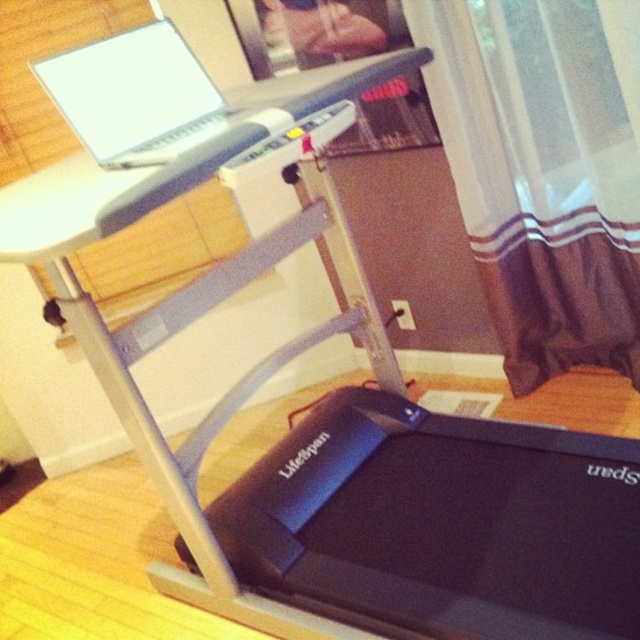
You are standing at the center of the room facing the treadmill. Which direction should you turn to look at the brown sheer curtain at right?

The brown sheer curtain at right is located at the right side of the room, so you should turn to your right to face it.

You are setting up a home office and need to place a new monitor on the desk. The monitor will be placed to the right of the white matte laptop at upper left. Will the brown sheer curtain at right interfere with placing the monitor there?

The brown sheer curtain at right is below the white matte laptop at upper left, so placing the monitor to the right of the white matte laptop at upper left should not interfere with the curtain since the curtain is positioned lower on the desk.

You are a delivery person who needs to place a 1.5 meter long package in this room. The package must be placed horizontally. Is there enough space between the brown sheer curtain at right and the viewer to fit the package horizontally?

The distance between the brown sheer curtain at right and the viewer is 1.58 meters. Since the package is 1.5 meters long, it can fit horizontally as the space is slightly larger than the package.